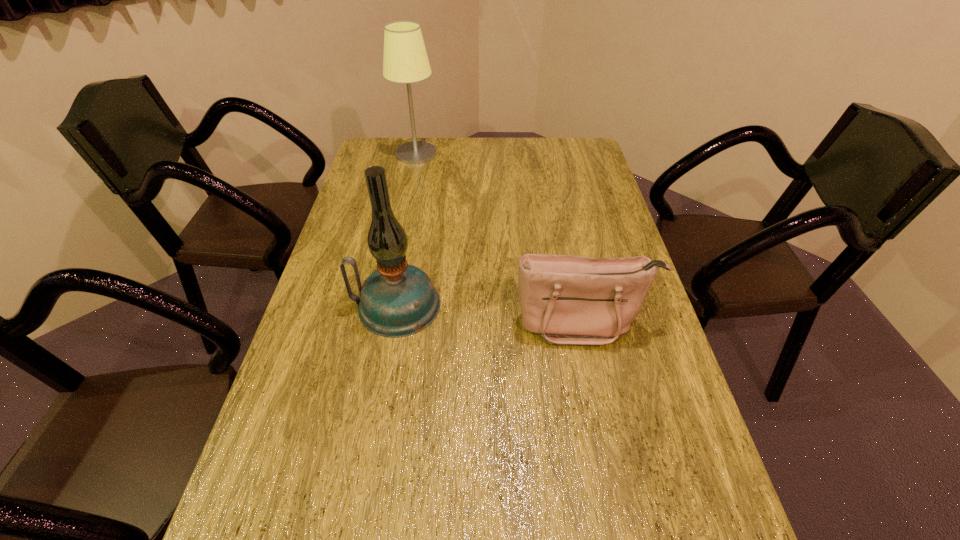
Identify the location of vacant region between the table lamp and the oil lamp. This screenshot has width=960, height=540. (406, 230).

Where is `the second closest object to the table lamp`? the second closest object to the table lamp is located at coordinates (568, 300).

Identify which object is located as the nearest to the shortest object. Please provide its 2D coordinates. Your answer should be formatted as a tuple, i.e. [(x, y)], where the tuple contains the x and y coordinates of a point satisfying the conditions above.

[(397, 300)]